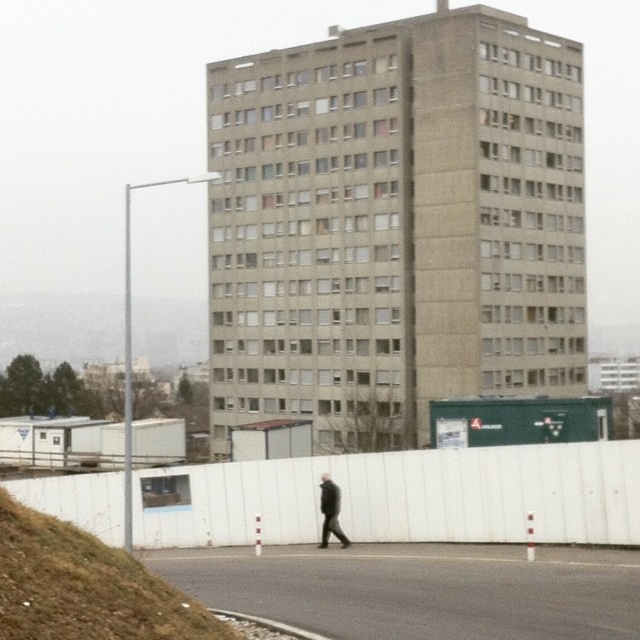
You are a city planner reviewing this urban area. The gray concrete building at center and the green grass at lower left are both part of the current layout. If you want to add a new playground, which area would be more suitable based on their sizes?

The gray concrete building at center has a larger size compared to green grass at lower left, so the gray concrete building at center would provide a more suitable area for adding a new playground due to its greater space availability.

You are a delivery person who needs to place a package on the green grass at lower left. However, there is a dark gray coat at center nearby. Considering the height of the grass and the coat, which object is shorter?

The green grass at lower left is not as tall as the dark gray coat at center, so the green grass at lower left is shorter.